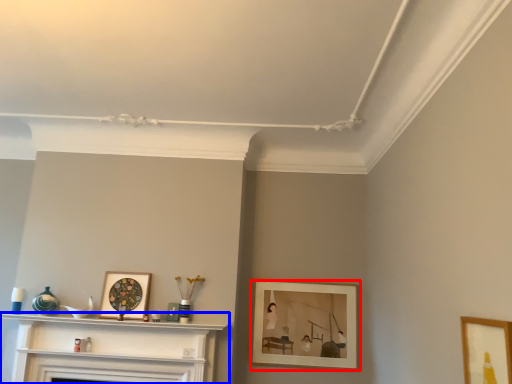
Question: Which point is further to the camera, picture frame (highlighted by a red box) or shelf (highlighted by a blue box)?

Choices:
 (A) picture frame
 (B) shelf

Answer: (A)